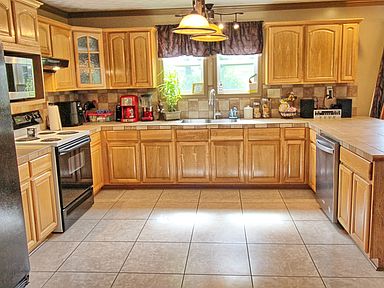
Look for what you use to keep your food cold and from going bad in the image and show me where they are. Your answer should be formatted as a list of tuples, i.e. [(x1, y1), (x2, y2), ...], where each tuple contains the x and y coordinates of a point satisfying the conditions above.

[(9, 192)]